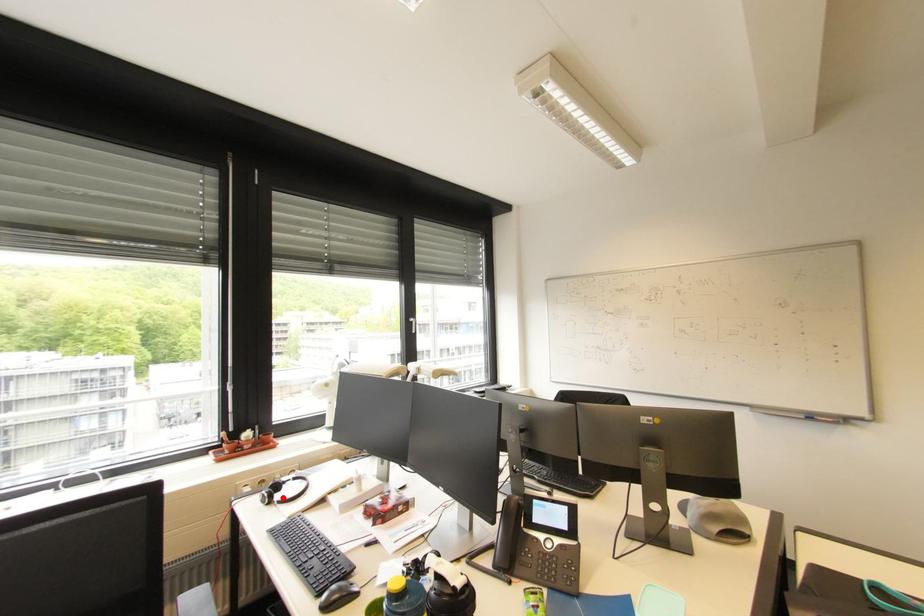
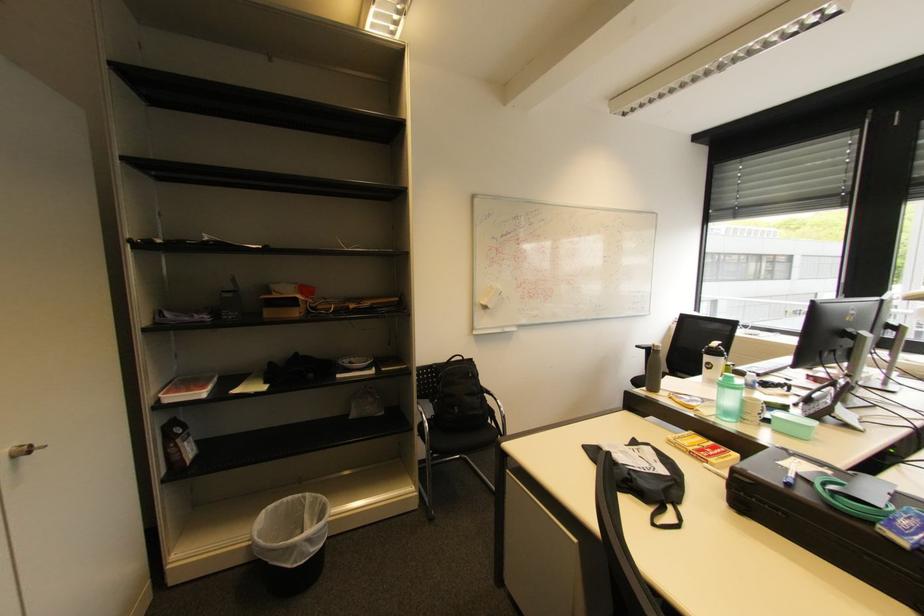
Question: I am providing you with two images of the same scene from different viewpoints. A red point is marked on the first image. Is the red point's position out of view in image 2?

Choices:
 (A) Yes
 (B) No

Answer: (A)